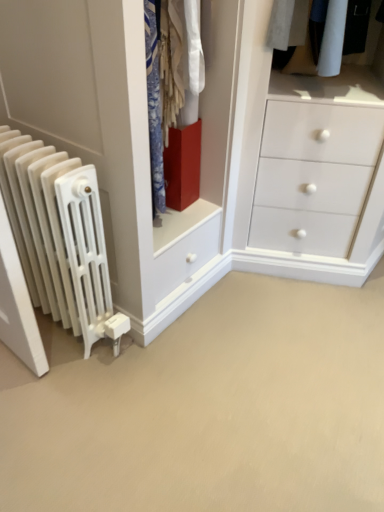
Question: Should I look upward or downward to see white matte radiator at left?

Choices:
 (A) down
 (B) up

Answer: (B)

Question: Does white matte radiator at left have a greater width compared to matte red cube at center?

Choices:
 (A) yes
 (B) no

Answer: (A)

Question: Does white matte radiator at left have a larger size compared to matte red cube at center?

Choices:
 (A) no
 (B) yes

Answer: (B)

Question: Is matte red cube at center inside white matte radiator at left?

Choices:
 (A) no
 (B) yes

Answer: (A)

Question: Is the position of white matte radiator at left more distant than that of matte red cube at center?

Choices:
 (A) no
 (B) yes

Answer: (A)

Question: Are white matte radiator at left and matte red cube at center beside each other?

Choices:
 (A) yes
 (B) no

Answer: (B)

Question: Is white matte radiator at left facing away from matte red cube at center?

Choices:
 (A) yes
 (B) no

Answer: (B)

Question: Is white matte radiator at left not inside white matte radiator at left?

Choices:
 (A) yes
 (B) no

Answer: (A)

Question: Could you tell me if white matte radiator at left is turned towards white matte radiator at left?

Choices:
 (A) no
 (B) yes

Answer: (A)

Question: Does white matte radiator at left appear on the left side of white matte radiator at left?

Choices:
 (A) no
 (B) yes

Answer: (B)

Question: Is white matte radiator at left closer to the viewer compared to white matte radiator at left?

Choices:
 (A) no
 (B) yes

Answer: (A)

Question: Is white matte radiator at left located within white matte radiator at left?

Choices:
 (A) no
 (B) yes

Answer: (A)

Question: Is white matte radiator at left positioned far away from white matte radiator at left?

Choices:
 (A) yes
 (B) no

Answer: (B)

Question: Considering the relative positions of white matte radiator at left and white matte radiator at left in the image provided, is white matte radiator at left behind white matte radiator at left?

Choices:
 (A) no
 (B) yes

Answer: (A)